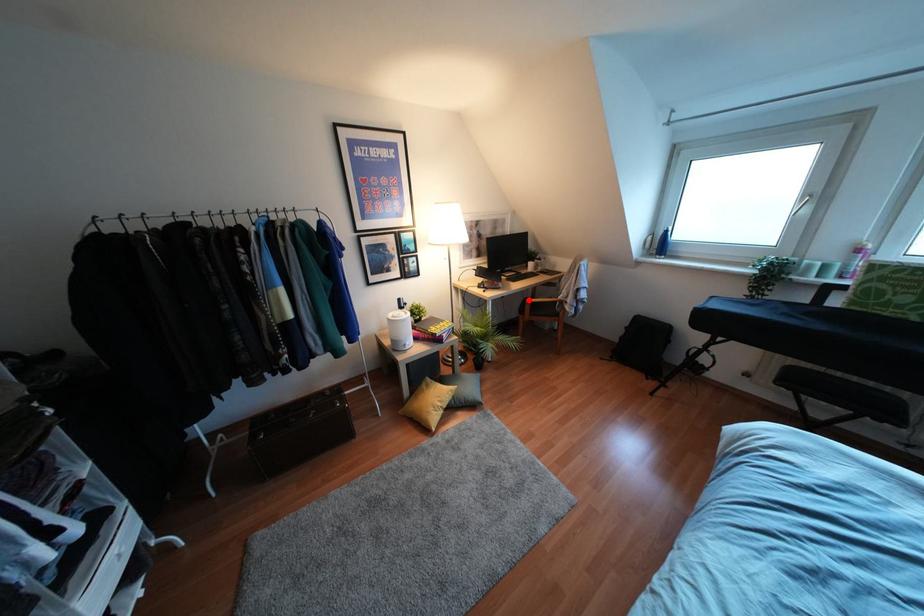
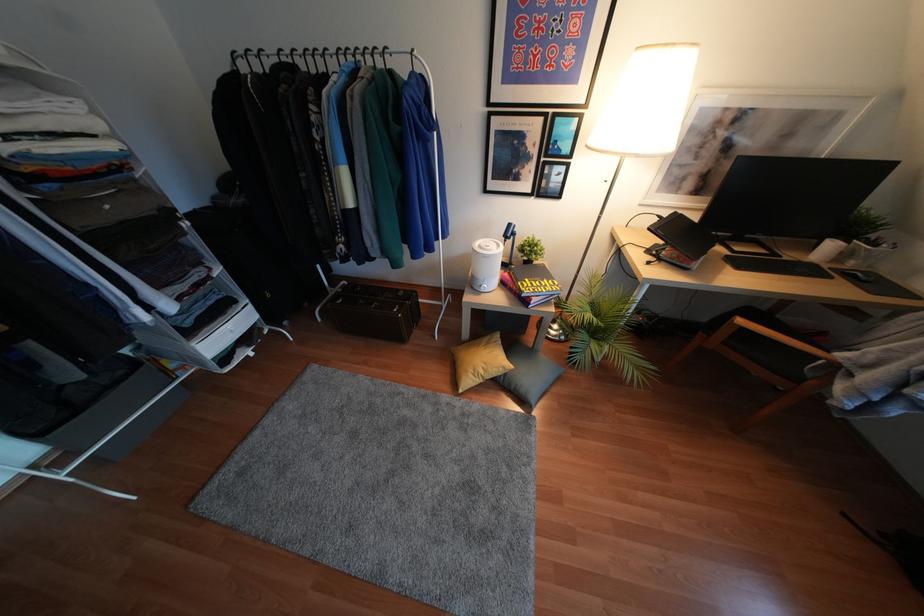
Question: I am providing you with two images of the same scene from different viewpoints. In image1, a red point is highlighted. Considering the same 3D point in image2, which of the following is correct?

Choices:
 (A) It is closer
 (B) It is farther

Answer: (B)